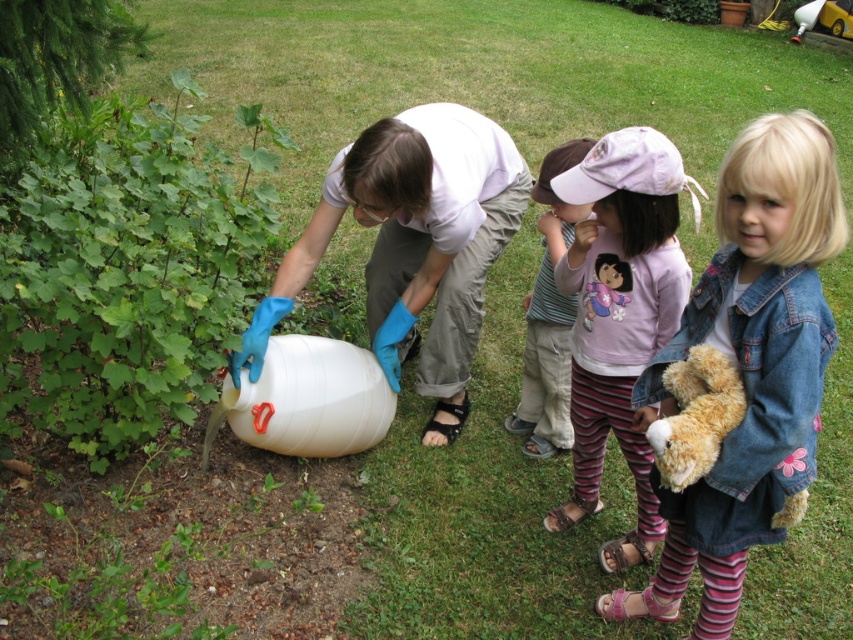
Question: Observing the image, what is the correct spatial positioning of white matte container at center-left in reference to brown plush teddy bear at lower right?

Choices:
 (A) right
 (B) left

Answer: (B)

Question: Which object is farther from the camera taking this photo?

Choices:
 (A) fuzzy brown teddy bear at lower right
 (B) pink cotton hat at center

Answer: (B)

Question: Which of the following is the closest to the observer?

Choices:
 (A) (662, 577)
 (B) (680, 426)
 (C) (688, 372)

Answer: (B)

Question: Is white matte container at center-left closer to the viewer compared to fuzzy brown teddy bear at lower right?

Choices:
 (A) no
 (B) yes

Answer: (A)

Question: Which point is closer to the camera?

Choices:
 (A) (379, 177)
 (B) (708, 330)

Answer: (B)

Question: Is white matte container at center-left below fuzzy brown teddy bear at lower right?

Choices:
 (A) yes
 (B) no

Answer: (B)